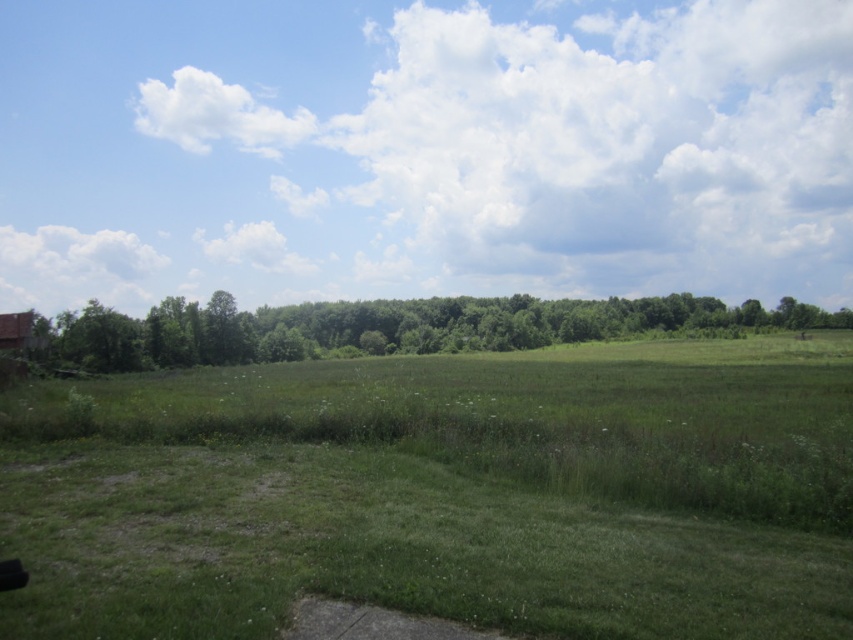
Question: Which point is closer to the camera?

Choices:
 (A) green leafy trees at center
 (B) green grassy pasture at center

Answer: (B)

Question: Can you confirm if green grassy pasture at center is positioned above green leafy trees at center?

Choices:
 (A) no
 (B) yes

Answer: (A)

Question: Is green grassy pasture at center smaller than green leafy trees at center?

Choices:
 (A) no
 (B) yes

Answer: (B)

Question: Does green grassy pasture at center have a larger size compared to green leafy trees at center?

Choices:
 (A) no
 (B) yes

Answer: (A)